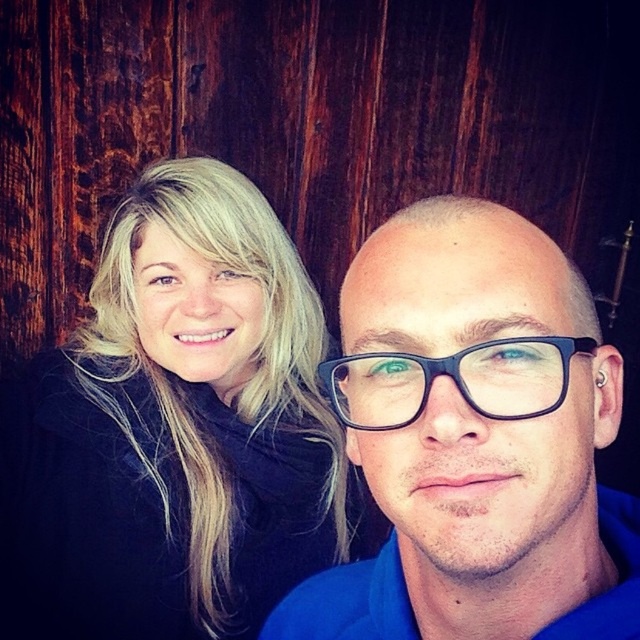
Is blue matte glasses at center thinner than black plastic glasses at center?

No.

Where is `blue matte glasses at center`? This screenshot has height=640, width=640. blue matte glasses at center is located at coordinates pyautogui.click(x=476, y=440).

Does point (566, 564) lie behind point (349, 388)?

That is True.

Image resolution: width=640 pixels, height=640 pixels. I want to click on blue matte glasses at center, so click(x=476, y=440).

Between point (170, 467) and point (518, 468), which one is positioned in front?

Point (518, 468) is more forward.

Is blonde hair at upper left bigger than blue matte glasses at center?

Yes.

I want to click on blonde hair at upper left, so click(173, 429).

Can you confirm if blonde hair at upper left is positioned below black plastic glasses at center?

Yes, blonde hair at upper left is below black plastic glasses at center.

Is the position of blonde hair at upper left more distant than that of black plastic glasses at center?

Yes, it is.

The image size is (640, 640). I want to click on blonde hair at upper left, so click(x=173, y=429).